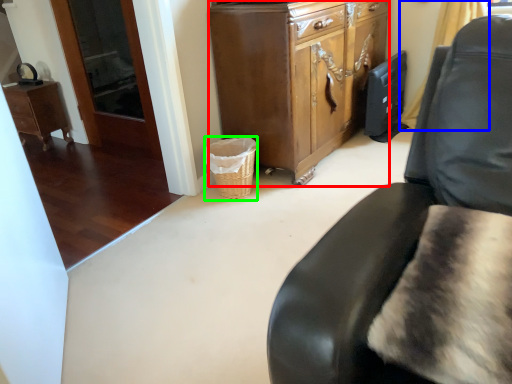
Question: Based on their relative distances, which object is nearer to cabinetry (highlighted by a red box)? Choose from curtain (highlighted by a blue box) and basket (highlighted by a green box).

Choices:
 (A) curtain
 (B) basket

Answer: (B)